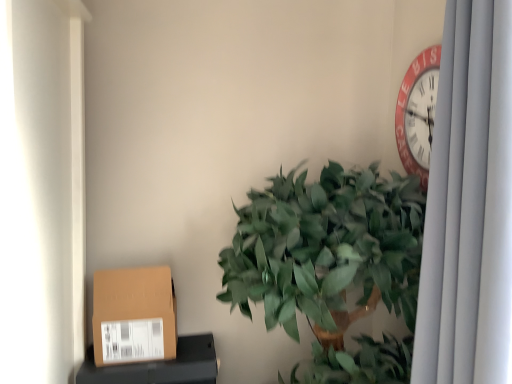
Question: Could you tell me if green leafy plant at center is turned towards brown cardboard box at lower left?

Choices:
 (A) no
 (B) yes

Answer: (A)

Question: Does green leafy plant at center have a greater height compared to brown cardboard box at lower left?

Choices:
 (A) yes
 (B) no

Answer: (A)

Question: Does green leafy plant at center have a greater width compared to brown cardboard box at lower left?

Choices:
 (A) yes
 (B) no

Answer: (A)

Question: Does green leafy plant at center have a larger size compared to brown cardboard box at lower left?

Choices:
 (A) no
 (B) yes

Answer: (B)

Question: Does green leafy plant at center appear on the left side of brown cardboard box at lower left?

Choices:
 (A) yes
 (B) no

Answer: (B)

Question: Could brown cardboard box at lower left be considered to be inside green leafy plant at center?

Choices:
 (A) yes
 (B) no

Answer: (B)

Question: Considering the relative sizes of brown cardboard box at lower left and white fabric curtain at right in the image provided, is brown cardboard box at lower left thinner than white fabric curtain at right?

Choices:
 (A) no
 (B) yes

Answer: (B)

Question: Could you tell me if brown cardboard box at lower left is facing white fabric curtain at right?

Choices:
 (A) yes
 (B) no

Answer: (B)

Question: Is brown cardboard box at lower left behind white fabric curtain at right?

Choices:
 (A) no
 (B) yes

Answer: (B)

Question: Considering the relative sizes of brown cardboard box at lower left and white fabric curtain at right in the image provided, is brown cardboard box at lower left shorter than white fabric curtain at right?

Choices:
 (A) no
 (B) yes

Answer: (B)

Question: From a real-world perspective, is brown cardboard box at lower left on white fabric curtain at right?

Choices:
 (A) no
 (B) yes

Answer: (A)

Question: From the image's perspective, is brown cardboard box at lower left located beneath white fabric curtain at right?

Choices:
 (A) yes
 (B) no

Answer: (A)

Question: From a real-world perspective, is brown cardboard box at lower left located higher than brown cardboard box at lower left?

Choices:
 (A) no
 (B) yes

Answer: (A)